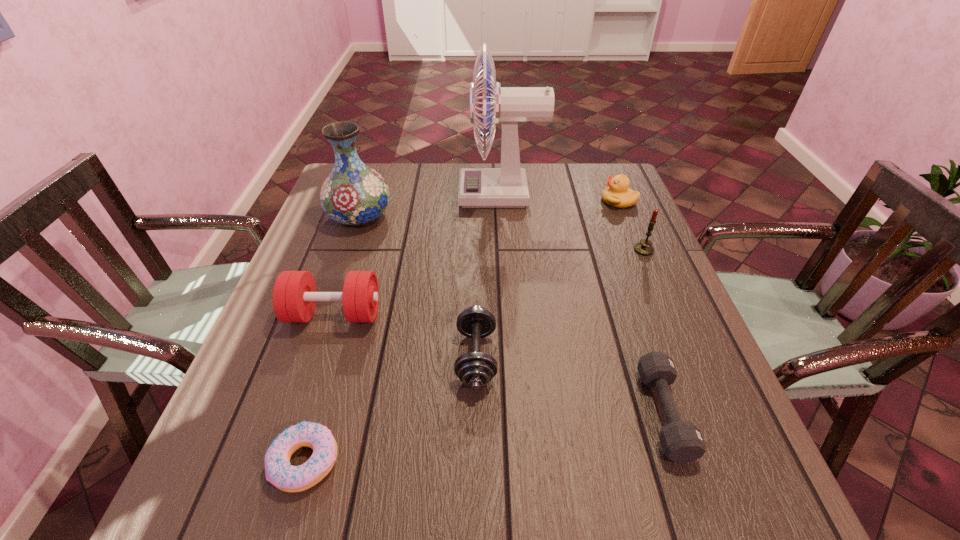
Where is `vacant space situated on the front-facing side of the tallest object`? The image size is (960, 540). vacant space situated on the front-facing side of the tallest object is located at coordinates (440, 194).

Identify the location of blank space located on the front-facing side of the tallest object. (423, 194).

Locate an element on the screen. vacant space located on the front of the vase is located at coordinates (326, 317).

The width and height of the screenshot is (960, 540). I want to click on free spot located 0.060m on the left of the fourth farthest object, so click(612, 250).

Where is `vacant space located on the back of the tallest dumbbell`? This screenshot has height=540, width=960. vacant space located on the back of the tallest dumbbell is located at coordinates (348, 273).

This screenshot has height=540, width=960. Identify the location of free region located on the front-facing side of the duckling. (555, 201).

In order to click on free space located on the front-facing side of the duckling in this screenshot , I will do `click(497, 201)`.

At what (x,y) coordinates should I click in order to perform the action: click on vacant space positioned on the front-facing side of the duckling. Please return your answer as a coordinate pair (x, y). Looking at the image, I should click on (555, 201).

Image resolution: width=960 pixels, height=540 pixels. In order to click on free space located on the right of the second dumbbell from left to right in this screenshot , I will do `click(609, 357)`.

Locate an element on the screen. This screenshot has width=960, height=540. vacant space located 0.050m on the back of the shortest dumbbell is located at coordinates (x=642, y=350).